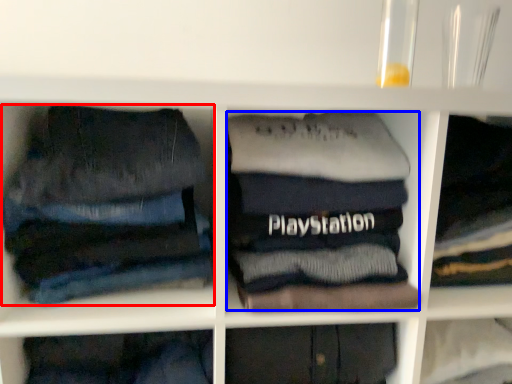
Question: Which object appears farthest to the camera in this image, trousers (highlighted by a red box) or clothing (highlighted by a blue box)?

Choices:
 (A) trousers
 (B) clothing

Answer: (B)